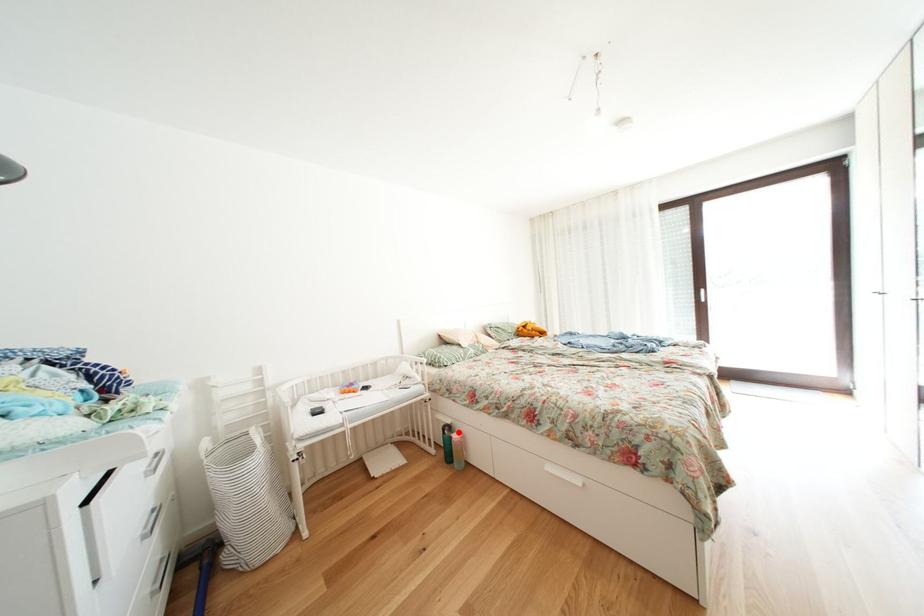
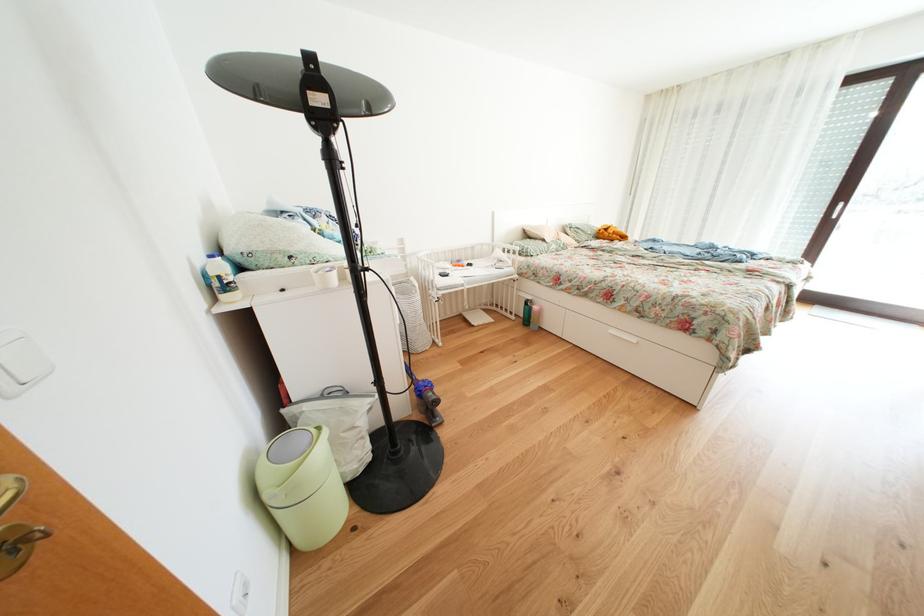
In the second image, find the point that corresponds to the highlighted location in the first image.

(541, 307)